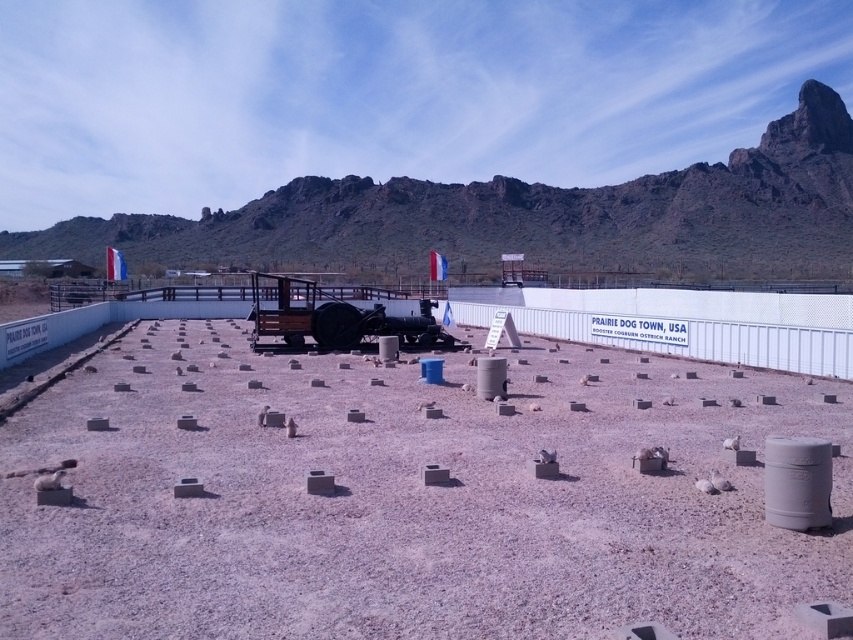
You are planning to place a small tent on the brown gravel dirt at center and the rugged rock formation at upper center. Which location has enough space to accommodate the tent?

The rugged rock formation at upper center has more space since it is larger than the brown gravel dirt at center.

You are standing in the desert and want to place a tall cactus between the brown gravel dirt at center and the rugged rock formation at upper center. Which object should the cactus be placed closer to?

The cactus should be placed closer to the brown gravel dirt at center because it is shorter than the rugged rock formation at upper center, allowing the cactus to grow without obstruction from the taller rock formation.